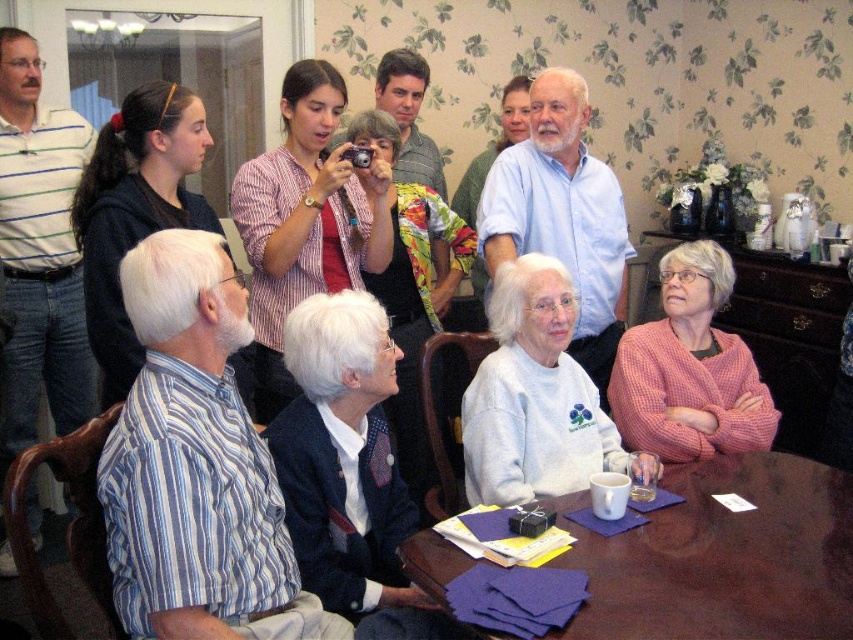
You are standing in the dining room and need to place a decorative plate exactly at the center of the room. The white fleece sweater at center is currently occupying the center point. Can you move the sweater to make space for the plate?

The white fleece sweater at center is located at point (537, 397), which is very close to the center of the room. Moving it slightly would allow space for the decorative plate.

You are at a family gathering and see two sweaters on the table. The white fleece sweater at center and the matte blue sweater at center. Which one is positioned to the right?

The white fleece sweater at center is to the right of the matte blue sweater at center.